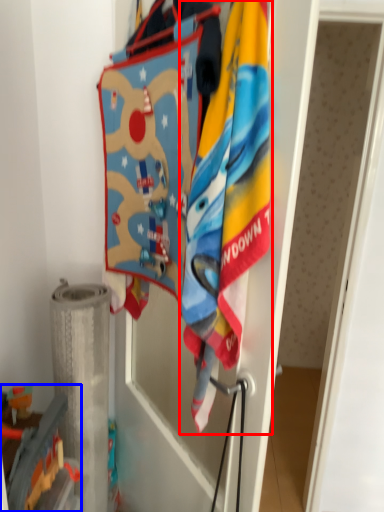
Question: Which point is closer to the camera, towel (highlighted by a red box) or toy (highlighted by a blue box)?

Choices:
 (A) towel
 (B) toy

Answer: (A)